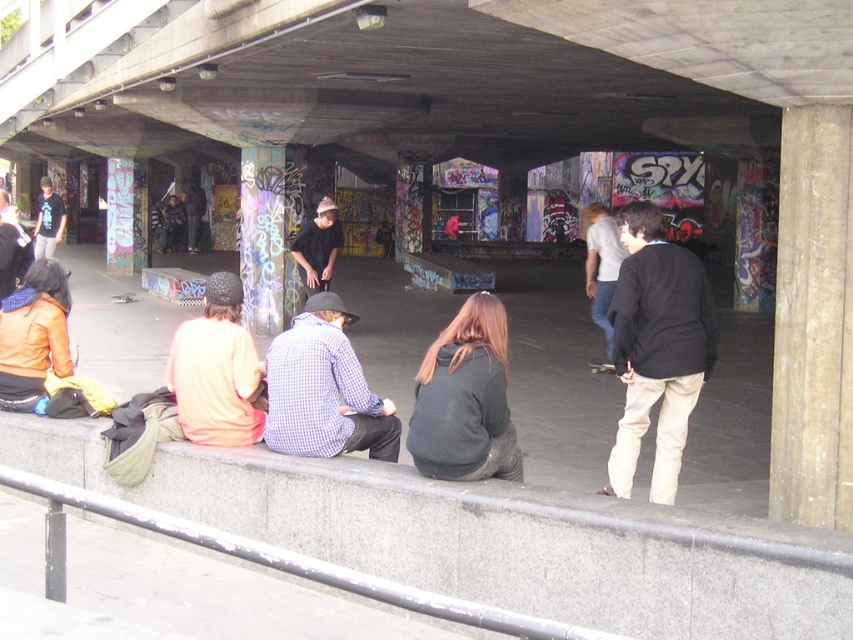
Question: Does checkered fabric shirt at center appear under light brown leather jacket at center?

Choices:
 (A) no
 (B) yes

Answer: (B)

Question: Can you confirm if gray concrete curb at lower center is wider than matte black shirt at left?

Choices:
 (A) no
 (B) yes

Answer: (A)

Question: Which object is positioned closest to the light brown leather jacket at center?

Choices:
 (A) checkered fabric shirt at center
 (B) dark brown sweater at center

Answer: (B)

Question: Can you confirm if checkered fabric shirt at center is wider than light brown leather jacket at center?

Choices:
 (A) yes
 (B) no

Answer: (B)

Question: Which of the following is the farthest from the observer?

Choices:
 (A) (44, 243)
 (B) (645, 200)
 (C) (601, 236)

Answer: (B)

Question: Among these points, which one is nearest to the camera?

Choices:
 (A) (677, 433)
 (B) (202, 326)

Answer: (B)